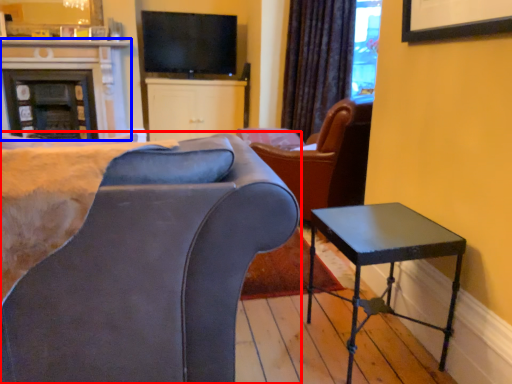
Question: Among these objects, which one is nearest to the camera, chair (highlighted by a red box) or fireplace (highlighted by a blue box)?

Choices:
 (A) chair
 (B) fireplace

Answer: (A)